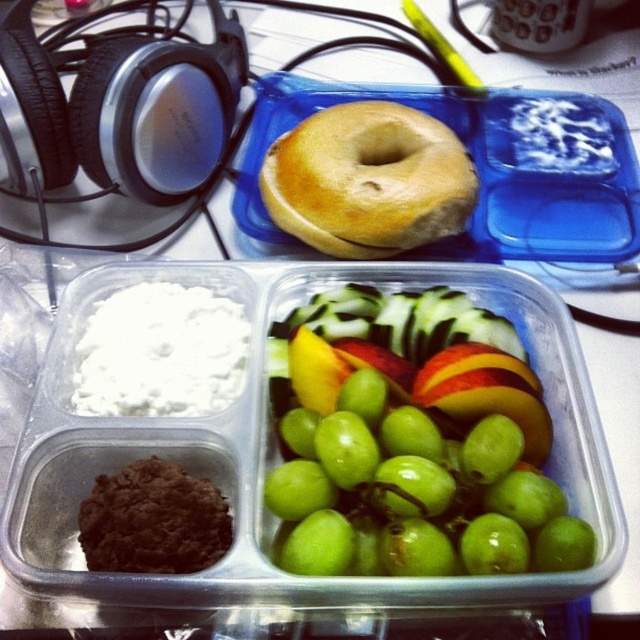
You are planning to pack snacks for a picnic and have a small container that can only fit items wider than 10 cm. You see the green matte grapes at center and the golden brown bagel at center in your lunchbox. Which of these items might not fit into the container if their widths are exactly 10 cm?

The golden brown bagel at center might not fit into the container because the green matte grapes at center has a larger width than the golden brown bagel at center, meaning the bagel is narrower and could be exactly 10 cm or smaller. Since the container requires items wider than 10 cm, the bagel might not meet the width requirement.

You are a nutritionist analyzing the meal layout. The container has four sections. Which object is positioned lower in the container between the green matte grapes at center and the golden brown bagel at center?

The green matte grapes at center are located below the golden brown bagel at center, so the grapes are positioned lower in the container.

You are a nutritionist analyzing the meal arrangement. Which of the two items, the green matte grapes at center or the golden brown bagel at center, is positioned lower in the container?

The green matte grapes at center is shorter than the golden brown bagel at center, so the green matte grapes at center is positioned lower in the container.